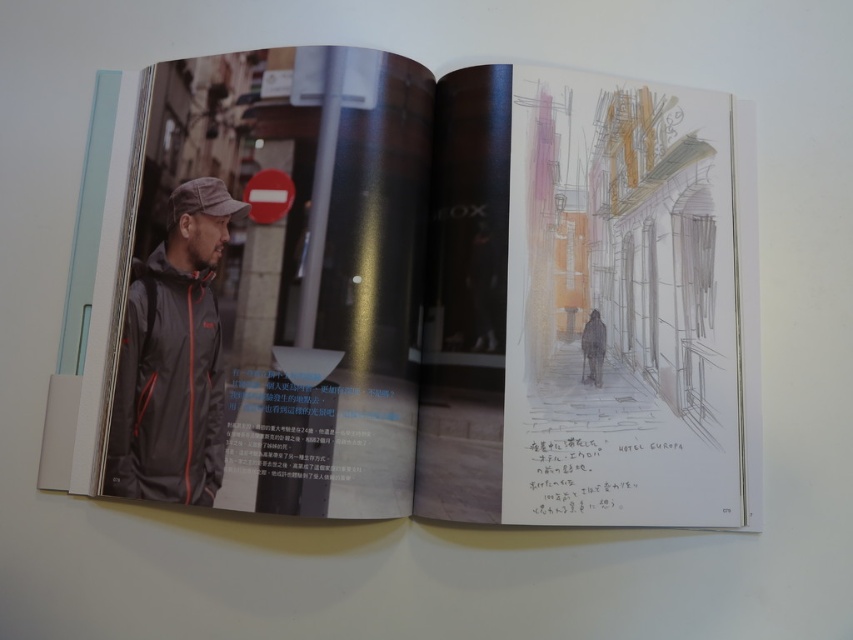
You are an artist who wants to paint the jacket on the left page of the open book. Which jacket should you focus on, the matte black jacket at left or the dark gray matte jacket at left?

The matte black jacket at left is positioned over the dark gray matte jacket at left, so you should focus on the matte black jacket at left as it is the visible one on top.

You are holding a camera and want to take a photo of the point at coordinates point (679, 161). If you are currently 25.63 inches away from it, is that a suitable distance for capturing the entire scene in your shot?

The point (679, 161) is 25.63 inches away from the camera. This distance may be suitable for capturing the entire scene, but it ultimately depends on the camera lens and zoom settings. Ensure your camera is set to an appropriate focal length to include the whole area around point (679, 161) in the frame.

You are a photographer standing at the camera position. You want to capture a closeup shot of the matte black jacket at left without moving the camera. Is it feasible?

The matte black jacket at left is 21.64 inches away from camera, so yes, it is feasible to capture a closeup shot of the matte black jacket at left without moving the camera since the distance is manageable for a closeup.